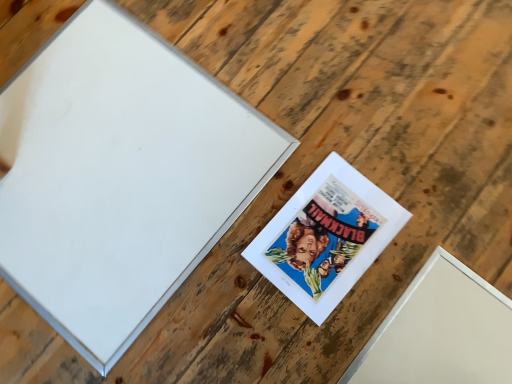
The width and height of the screenshot is (512, 384). In order to click on vacant space to the right of matte paper picture frame at center, placed as the 2th picture frame when sorted from left to right in this screenshot , I will do `click(438, 221)`.